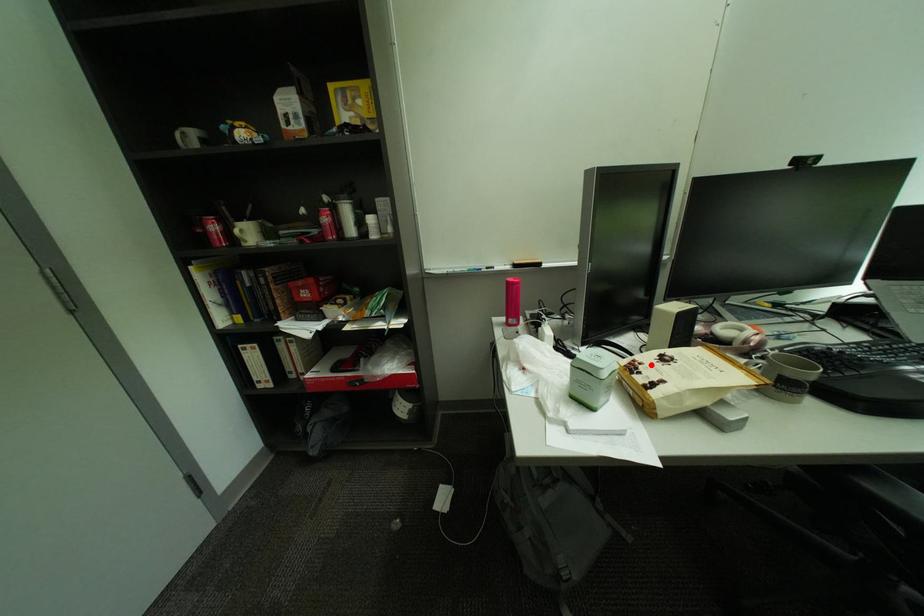
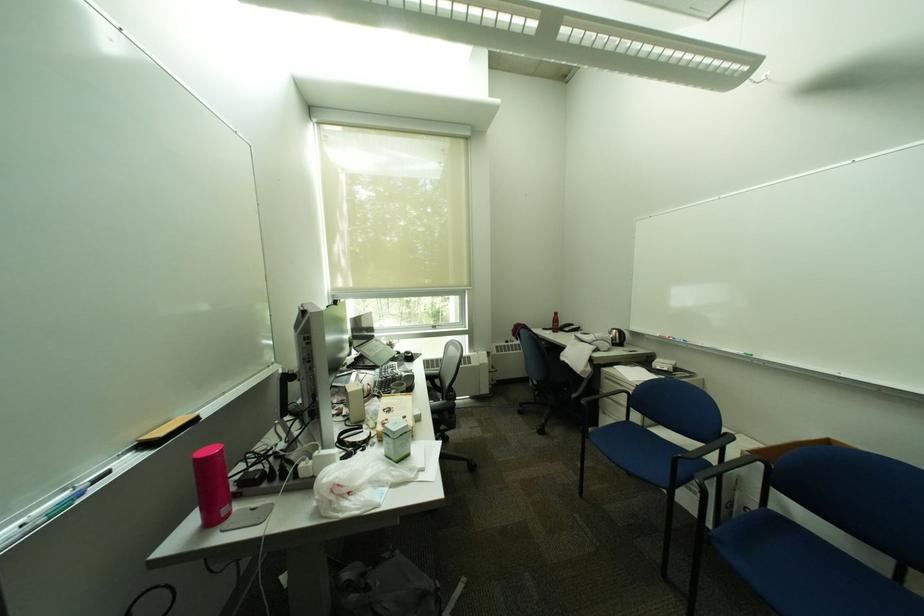
Find the pixel in the second image that matches the highlighted location in the first image.

(397, 421)